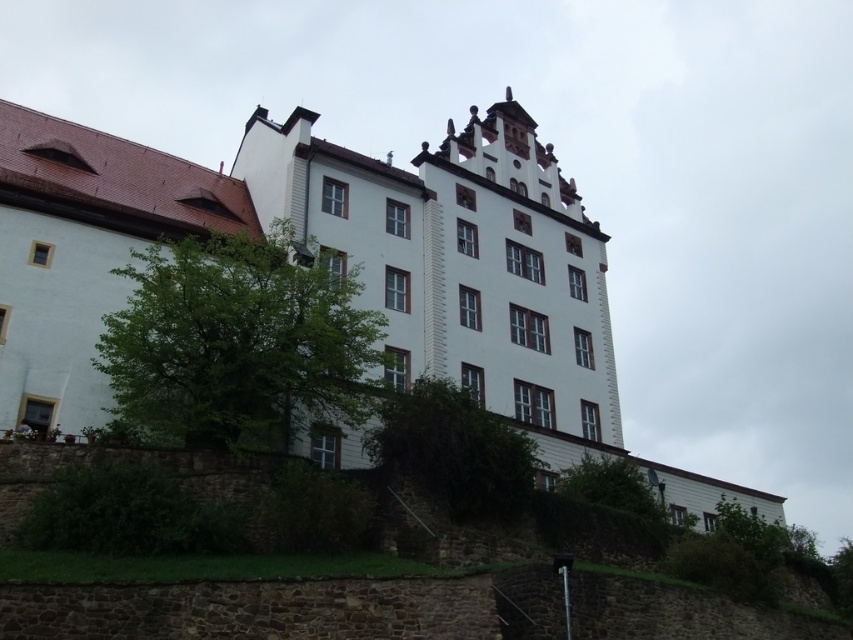
Question: Can you confirm if green leafy tree at center is positioned to the left of green leafy bush at center?

Choices:
 (A) no
 (B) yes

Answer: (B)

Question: Based on their relative distances, which object is farther from the green leafy tree at lower right?

Choices:
 (A) green leafy bush at center
 (B) green leafy tree at center

Answer: (B)

Question: Is green leafy bush at center smaller than green leafy tree at lower right?

Choices:
 (A) yes
 (B) no

Answer: (B)

Question: Which is farther from the green leafy tree at center?

Choices:
 (A) green leafy tree at lower right
 (B) green leafy bush at center

Answer: (A)

Question: Among these objects, which one is nearest to the camera?

Choices:
 (A) green leafy tree at center
 (B) green leafy bush at center
 (C) green leafy tree at lower right

Answer: (A)

Question: Does green leafy bush at center appear under green leafy tree at lower right?

Choices:
 (A) yes
 (B) no

Answer: (B)